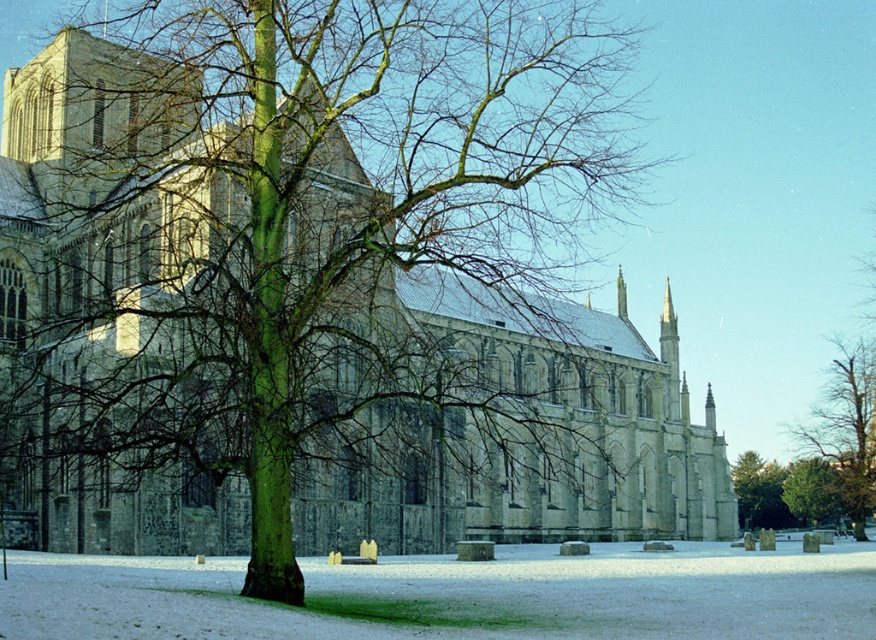
Does green rough bark tree at center appear under green rough bark tree at lower right?

Correct, green rough bark tree at center is located below green rough bark tree at lower right.

Is point (822, 465) positioned behind point (747, 456)?

That is False.

Identify the location of green rough bark tree at center. (811, 490).

Who is lower down, stone church at center or green rough bark tree at center?

Positioned lower is green rough bark tree at center.

Does stone church at center appear on the right side of green rough bark tree at center?

In fact, stone church at center is to the left of green rough bark tree at center.

I want to click on stone church at center, so click(x=121, y=305).

Locate an element on the screen. stone church at center is located at coordinates (121, 305).

Can you confirm if green bark tree at right is positioned to the left of green rough bark tree at center?

In fact, green bark tree at right is to the right of green rough bark tree at center.

This screenshot has width=876, height=640. Identify the location of green bark tree at right. (838, 445).